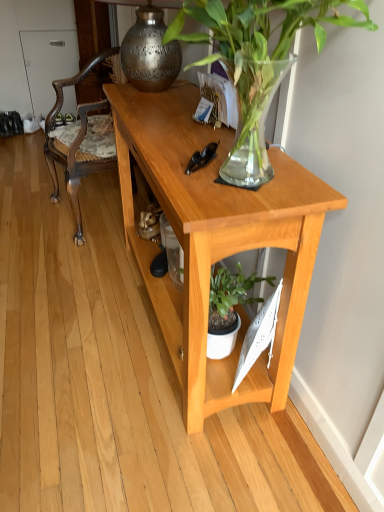
Question: In the image, is light wood desk at center positioned in front of or behind wooden carved chair at left?

Choices:
 (A) front
 (B) behind

Answer: (A)

Question: Is light wood desk at center wider or thinner than wooden carved chair at left?

Choices:
 (A) wide
 (B) thin

Answer: (B)

Question: Estimate the real-world distances between objects in this image. Which object is closer to the green glossy plant at upper center?

Choices:
 (A) wooden carved chair at left
 (B) polished brass lamp at upper center
 (C) black plastic sunglasses at center
 (D) light wood desk at center

Answer: (C)

Question: Considering the real-world distances, which object is farthest from the polished brass lamp at upper center?

Choices:
 (A) wooden carved chair at left
 (B) black plastic sunglasses at center
 (C) light wood desk at center
 (D) green glossy plant at upper center

Answer: (A)